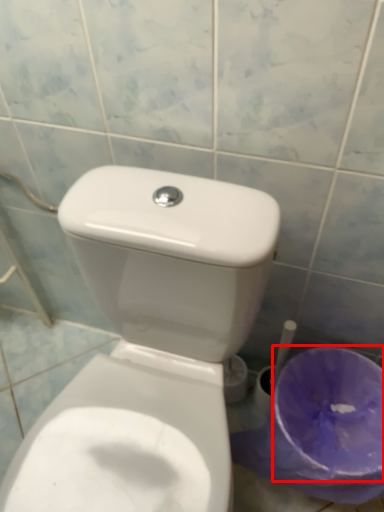
Question: From the image's perspective, considering the relative positions of potty (annotated by the red box) and toilet in the image provided, where is potty (annotated by the red box) located with respect to the staircase?

Choices:
 (A) below
 (B) above

Answer: (A)